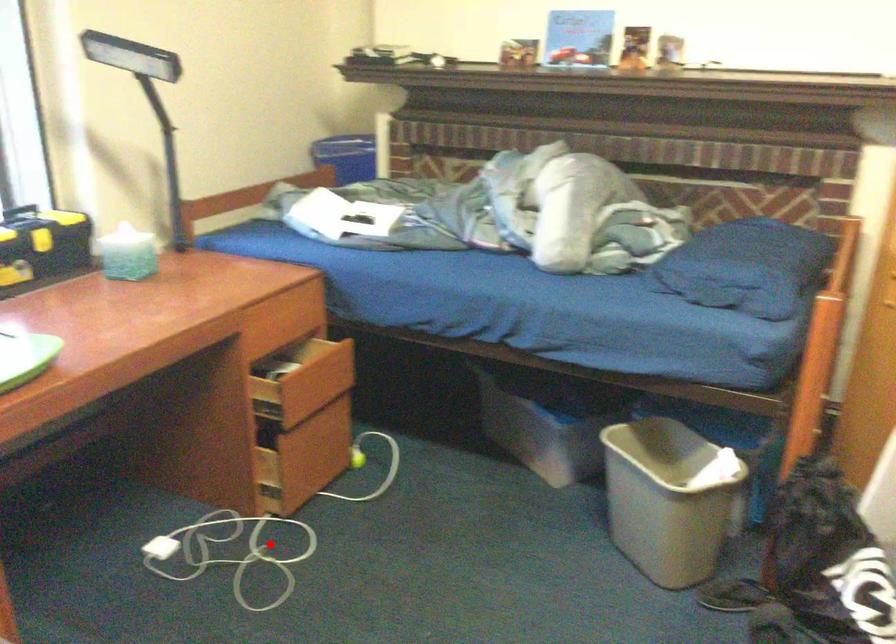
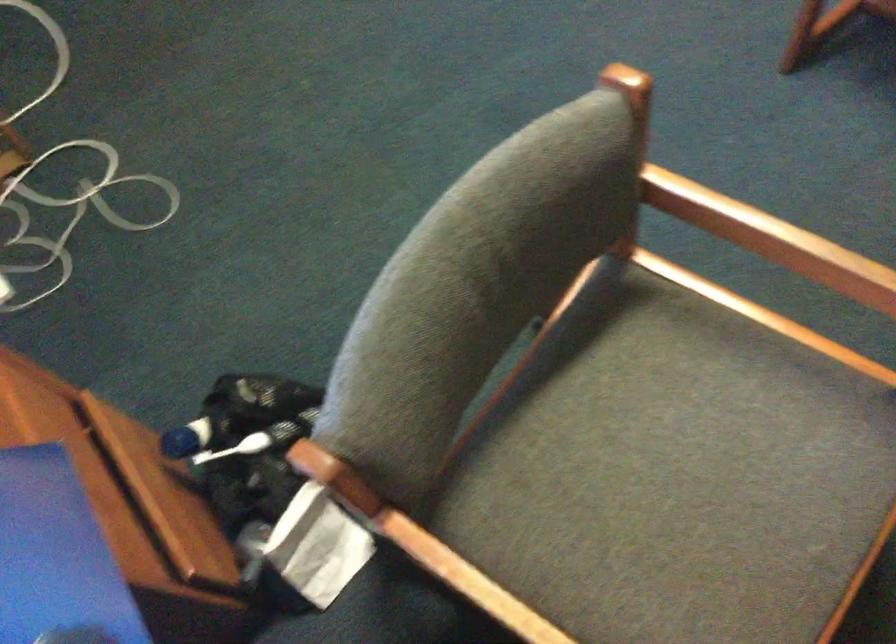
The point at the highlighted location is marked in the first image. Where is the corresponding point in the second image?

(63, 184)